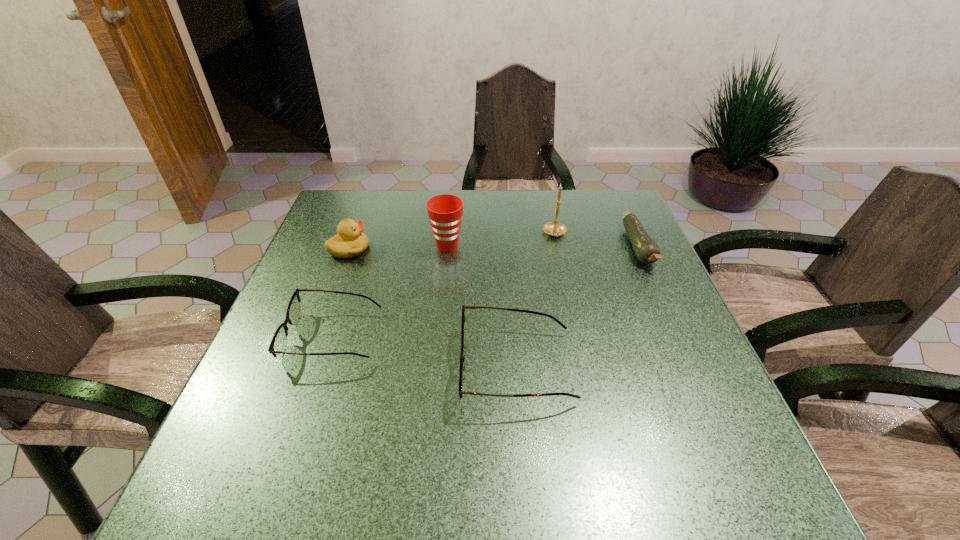
In order to click on the shorter spectacles in this screenshot , I will do `click(278, 344)`.

This screenshot has width=960, height=540. Identify the location of the fourth tallest object. (462, 358).

Where is `the right spectacles`? the right spectacles is located at coordinates (462, 358).

Locate an element on the screen. duckling is located at coordinates pos(349,242).

Locate an element on the screen. Image resolution: width=960 pixels, height=540 pixels. candle holder is located at coordinates (554, 228).

Find the location of a particular element. the second tallest object is located at coordinates (445, 211).

Find the location of a particular element. The height and width of the screenshot is (540, 960). the fourth object from right to left is located at coordinates (445, 211).

Image resolution: width=960 pixels, height=540 pixels. Find the location of `zucchini`. zucchini is located at coordinates click(647, 251).

At what (x,y) coordinates should I click in order to perform the action: click on free spot located on the face of the left spectacles. Please return your answer as a coordinate pair (x, y). This screenshot has height=540, width=960. Looking at the image, I should click on (268, 336).

Locate an element on the screen. vacant space located on the face of the right spectacles is located at coordinates (275, 367).